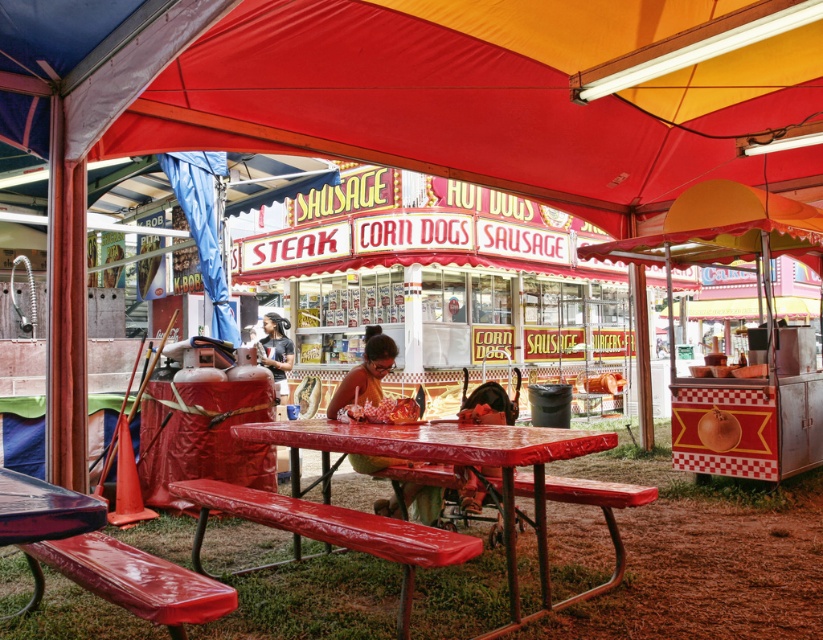
Does point (38, 508) come closer to viewer compared to point (614, 532)?

Yes, point (38, 508) is in front of point (614, 532).

Describe the element at coordinates (43, 509) in the screenshot. I see `shiny purple table at lower left` at that location.

The height and width of the screenshot is (640, 823). In order to click on shiny purple table at lower left in this screenshot , I will do `click(43, 509)`.

You are a GUI agent. You are given a task and a screenshot of the screen. Output one action in this format:
    pyautogui.click(x=<x>, y=<y>)
    Task: Click on the shiny purple table at lower left
    Image resolution: width=823 pixels, height=640 pixels.
    Given the screenshot: What is the action you would take?
    pyautogui.click(x=43, y=509)

Which is in front, point (510, 486) or point (387, 461)?

Point (510, 486)

Which of these two, metallic red picnic table at center or matte plastic bag at center, stands taller?

Standing taller between the two is metallic red picnic table at center.

Identify the location of metallic red picnic table at center. The height and width of the screenshot is (640, 823). (453, 465).

Between matte plastic food truck at center and rubberized plastic bench at center, which one has more height?

rubberized plastic bench at center

The image size is (823, 640). What do you see at coordinates (442, 280) in the screenshot?
I see `matte plastic food truck at center` at bounding box center [442, 280].

I want to click on matte plastic food truck at center, so click(442, 280).